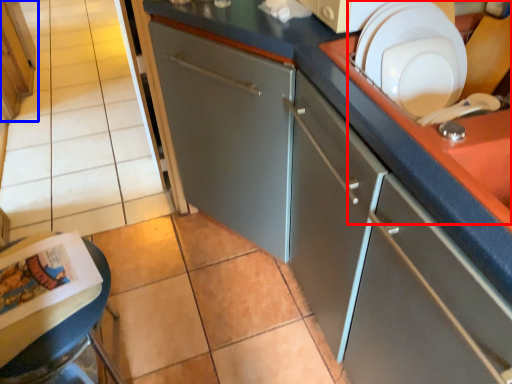
Question: Among these objects, which one is farthest to the camera, sink (highlighted by a red box) or cabinetry (highlighted by a blue box)?

Choices:
 (A) sink
 (B) cabinetry

Answer: (B)